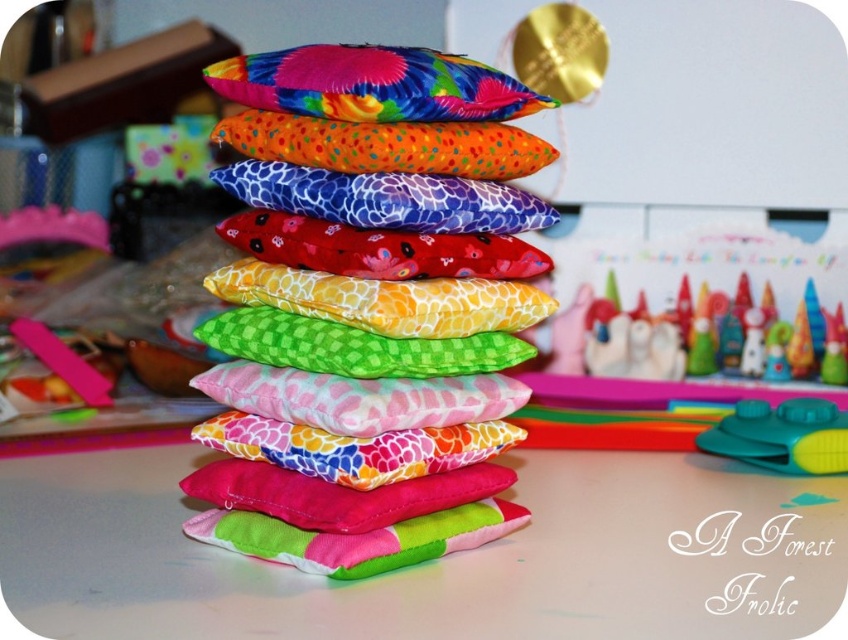
Between vibrant fabric pillows at center and multicolored fabric pillow at upper center, which one is positioned lower?

Positioned lower is vibrant fabric pillows at center.

Between point (462, 260) and point (395, 120), which one is positioned in front?

Positioned in front is point (395, 120).

Between point (212, 442) and point (244, 97), which one is positioned in front?

Positioned in front is point (244, 97).

In order to click on vibrant fabric pillows at center in this screenshot , I will do `click(369, 310)`.